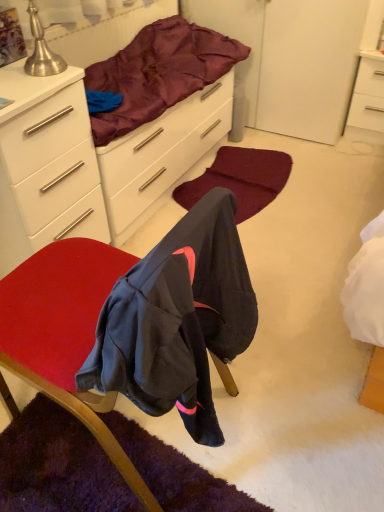
Question: Does point (117, 455) appear closer or farther from the camera than point (364, 140)?

Choices:
 (A) closer
 (B) farther

Answer: (A)

Question: From the image's perspective, is velvet-like red chair at center located above or below white glossy nightstand at upper right?

Choices:
 (A) above
 (B) below

Answer: (B)

Question: Estimate the real-world distances between objects in this image. Which object is farther from the silky purple blanket at upper center?

Choices:
 (A) white matte cabinet at upper left
 (B) burgundy carpet at center
 (C) white glossy nightstand at upper right
 (D) velvet-like red chair at center

Answer: (D)

Question: Which is farther from the white glossy nightstand at upper right?

Choices:
 (A) burgundy carpet at center
 (B) velvet-like red chair at center
 (C) white matte cabinet at upper left
 (D) silky purple blanket at upper center

Answer: (B)